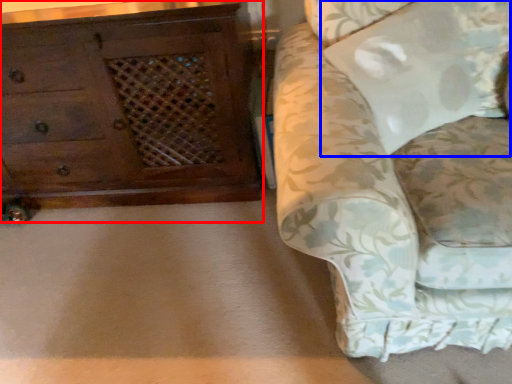
Question: Which object appears farthest to the camera in this image, chest of drawers (highlighted by a red box) or pillow (highlighted by a blue box)?

Choices:
 (A) chest of drawers
 (B) pillow

Answer: (A)